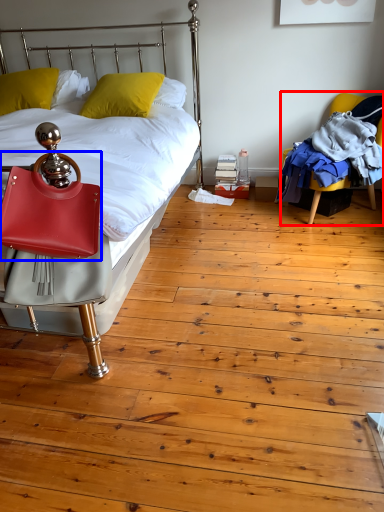
Question: Which of the following is the farthest to the observer, chair (highlighted by a red box) or handbag (highlighted by a blue box)?

Choices:
 (A) chair
 (B) handbag

Answer: (A)